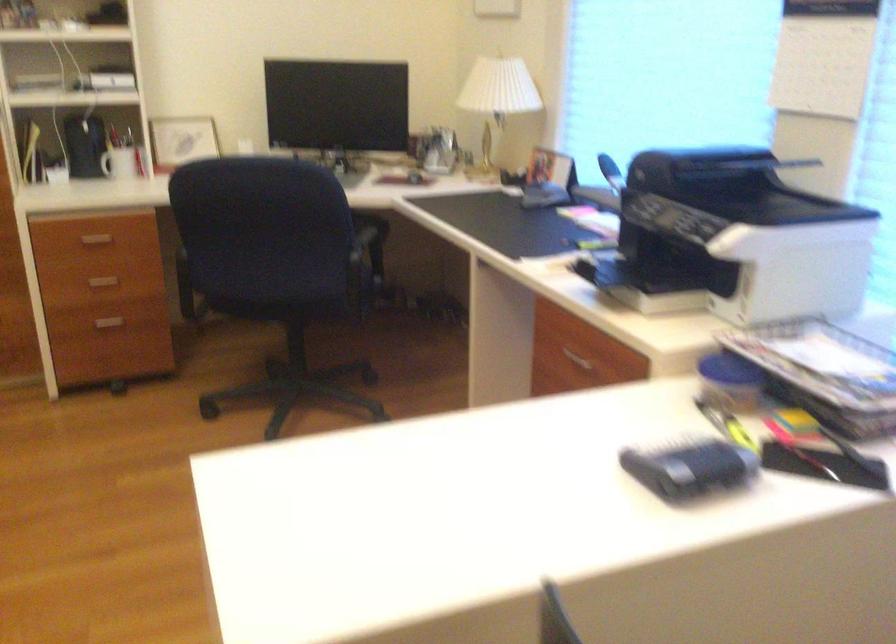
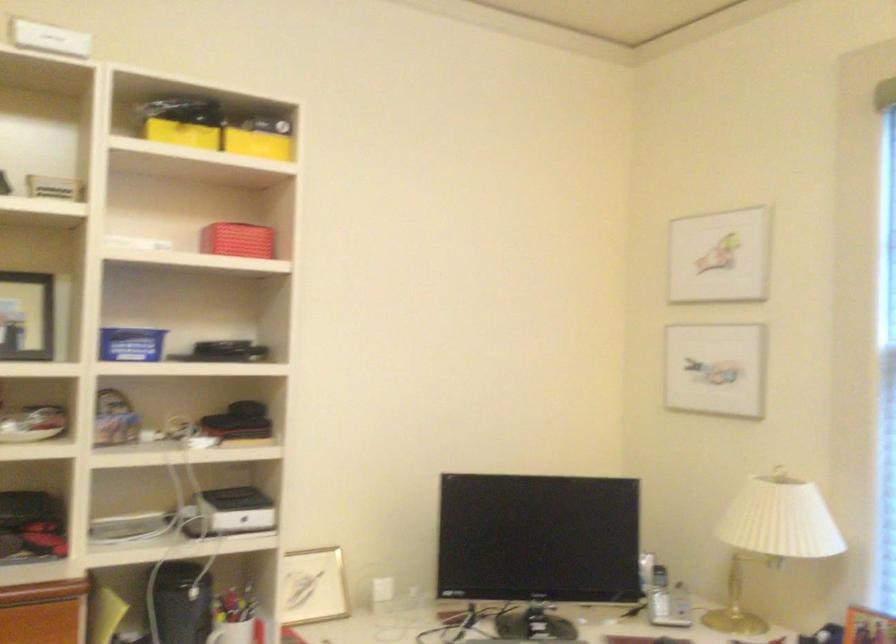
The point at (425,146) is marked in the first image. Where is the corresponding point in the second image?

(659, 594)